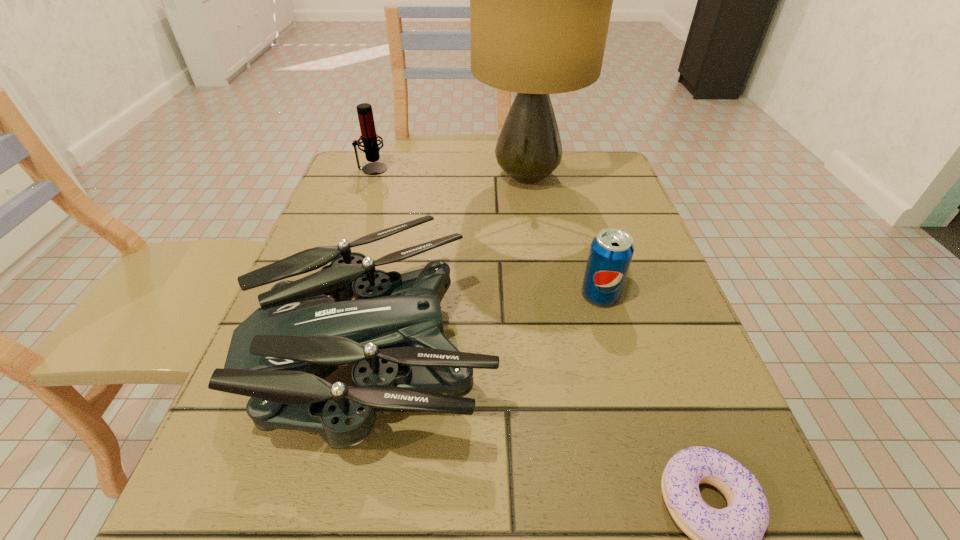
You are a GUI agent. You are given a task and a screenshot of the screen. Output one action in this format:
    pyautogui.click(x=<x>, y=<y>)
    Task: Click on the microphone that is at the left edge
    The width and height of the screenshot is (960, 540).
    Given the screenshot: What is the action you would take?
    tap(369, 137)

Where is `drone located in the left edge section of the desktop`? drone located in the left edge section of the desktop is located at coordinates (279, 356).

At what (x,y) coordinates should I click in order to perform the action: click on lampshade at the right edge. Please return your answer as a coordinate pair (x, y). Looking at the image, I should click on (540, 0).

Where is `pop soda that is at the right edge`? pop soda that is at the right edge is located at coordinates (611, 251).

Where is `object situated at the far left corner`? object situated at the far left corner is located at coordinates (369, 137).

Image resolution: width=960 pixels, height=540 pixels. Find the location of `object that is at the far right corner`. object that is at the far right corner is located at coordinates (540, 0).

The width and height of the screenshot is (960, 540). Find the location of `free space at the far edge`. free space at the far edge is located at coordinates (409, 177).

You are a GUI agent. You are given a task and a screenshot of the screen. Output one action in this format:
    pyautogui.click(x=<x>, y=<y>)
    Task: Click on the blank space at the near edge of the desktop
    The height and width of the screenshot is (540, 960).
    Given the screenshot: What is the action you would take?
    pyautogui.click(x=529, y=486)

Locate an element on the screen. vacant space at the left edge of the desktop is located at coordinates (368, 250).

Locate an element on the screen. vacant space at the right edge of the desktop is located at coordinates (652, 440).